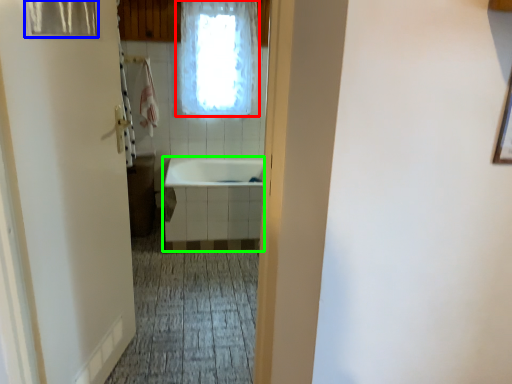
Question: Considering the real-world distances, which object is closest to window (highlighted by a red box)? shower curtain (highlighted by a blue box) or bath (highlighted by a green box).

Choices:
 (A) shower curtain
 (B) bath

Answer: (B)